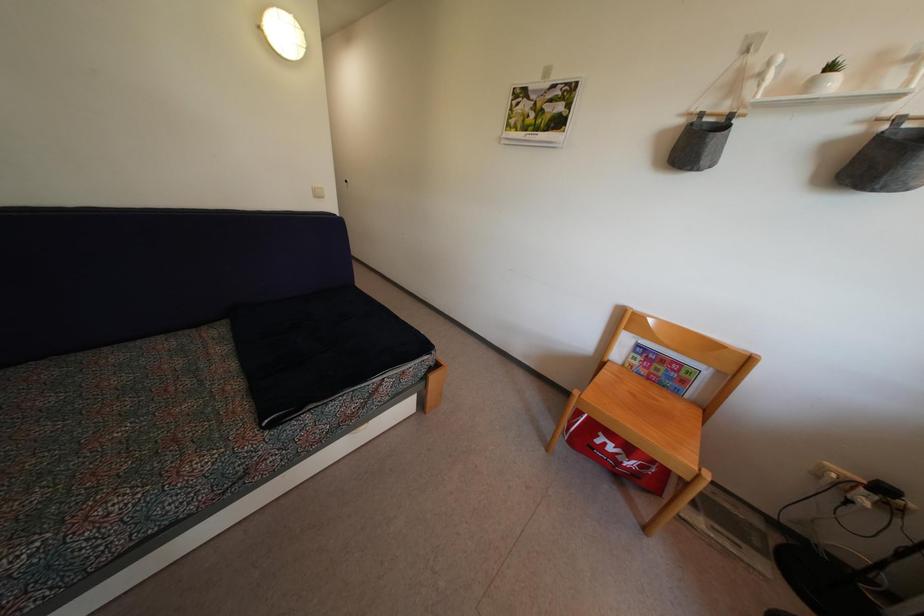
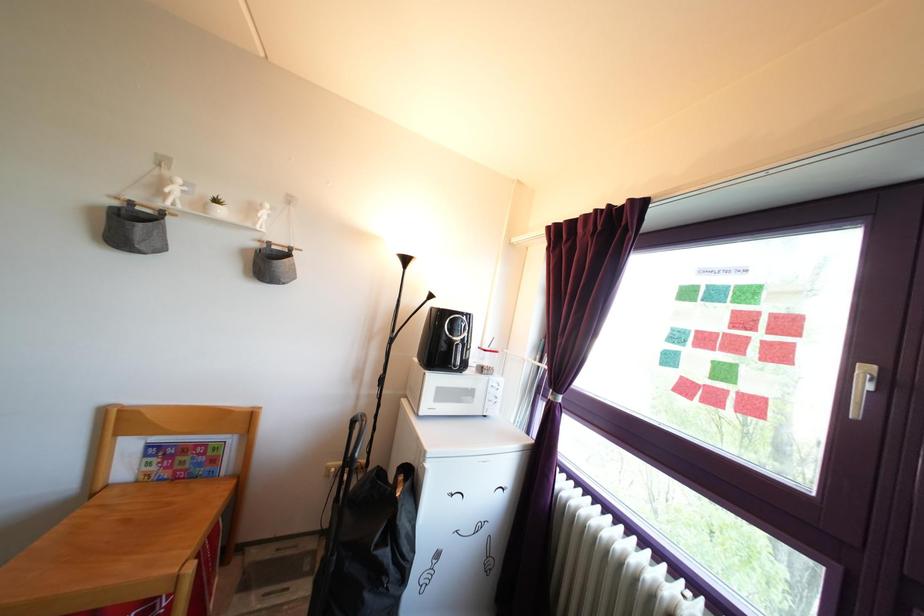
Where in the second image is the point corresponding to point 647,381 from the first image?

(169, 483)